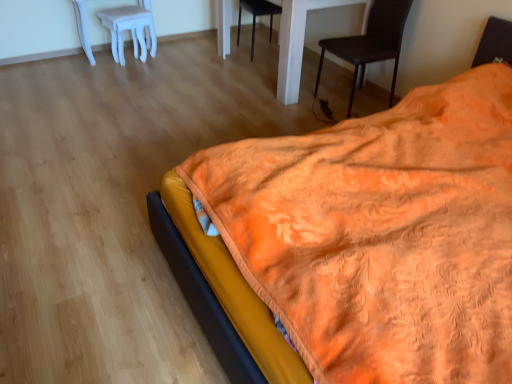
Question: From a real-world perspective, is white glossy table at center positioned above or below white plastic stool at upper left?

Choices:
 (A) below
 (B) above

Answer: (B)

Question: Relative to white plastic stool at upper left, is white glossy table at center in front or behind?

Choices:
 (A) front
 (B) behind

Answer: (A)

Question: Which object is positioned farthest from the white glossy table at center?

Choices:
 (A) black matte chair at center, acting as the second chair starting from the front
 (B) black leather chair at upper right, which appears as the second chair when viewed from the left
 (C) orange textured blanket at lower right
 (D) white plastic stool at upper left

Answer: (C)

Question: Which object is the closest to the white plastic stool at upper left?

Choices:
 (A) black leather chair at upper right, which appears as the first chair when viewed from the front
 (B) orange textured blanket at lower right
 (C) white glossy table at center
 (D) black matte chair at center, arranged as the 2th chair when viewed from the right

Answer: (D)